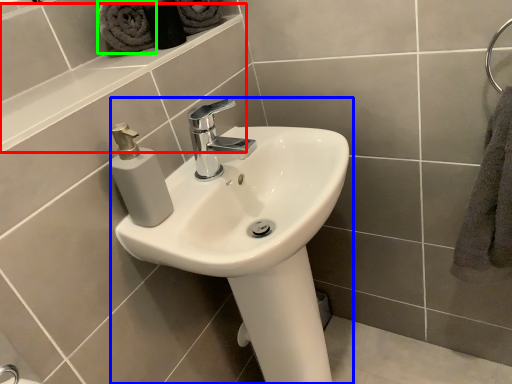
Question: Which object is positioned closest to ledge (highlighted by a red box)? Select from sink (highlighted by a blue box) and bath towel (highlighted by a green box).

Choices:
 (A) sink
 (B) bath towel

Answer: (B)